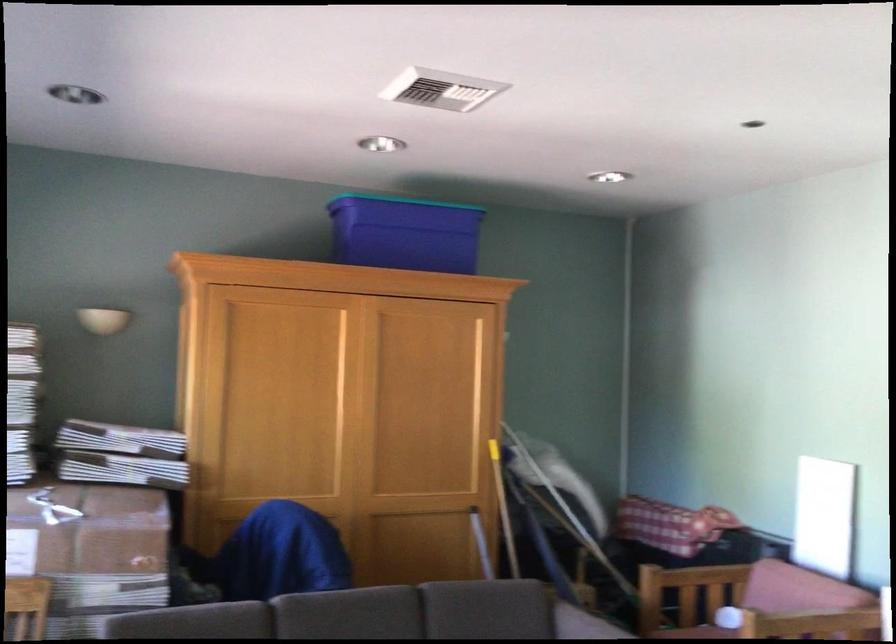
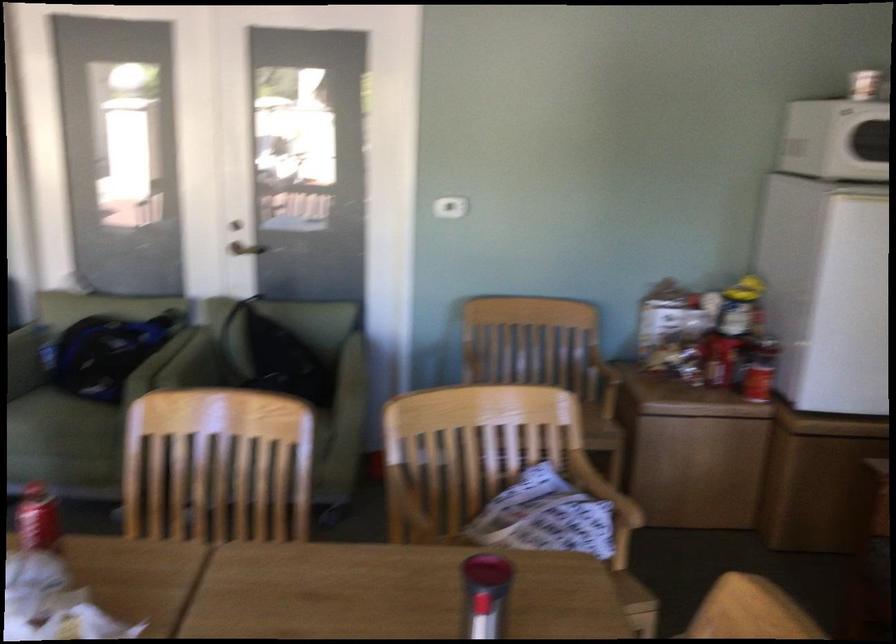
How did the camera likely rotate?

The camera's rotation is toward right-down.